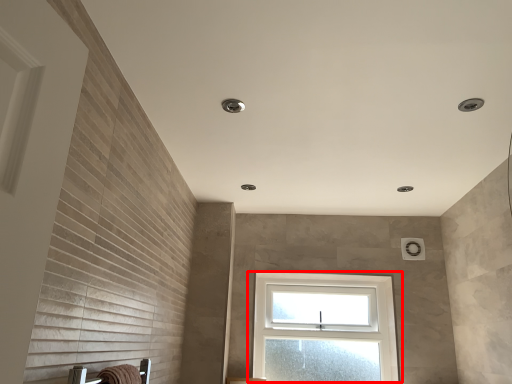
Question: From the image's perspective, what is the correct spatial relationship of window (annotated by the red box) in relation to bath towel?

Choices:
 (A) above
 (B) below

Answer: (B)